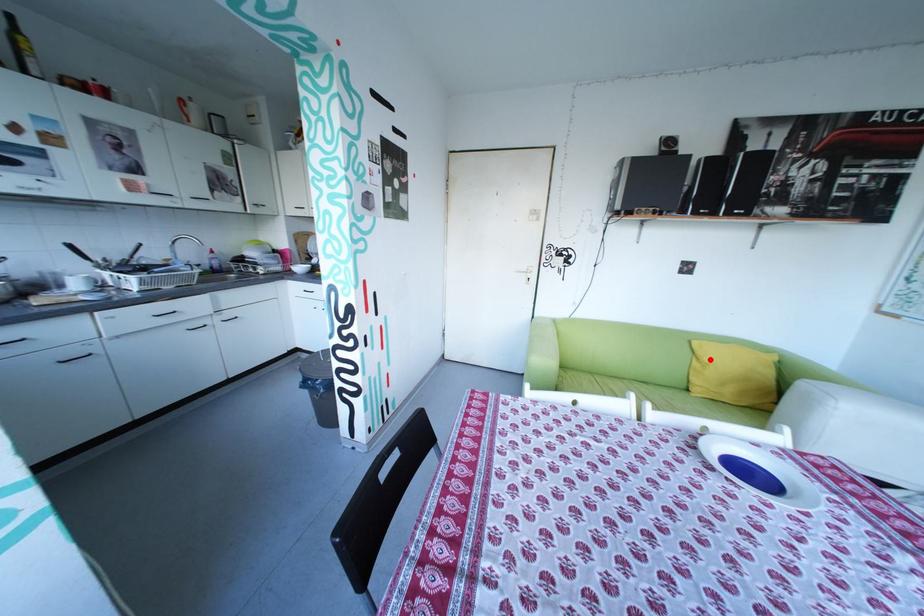
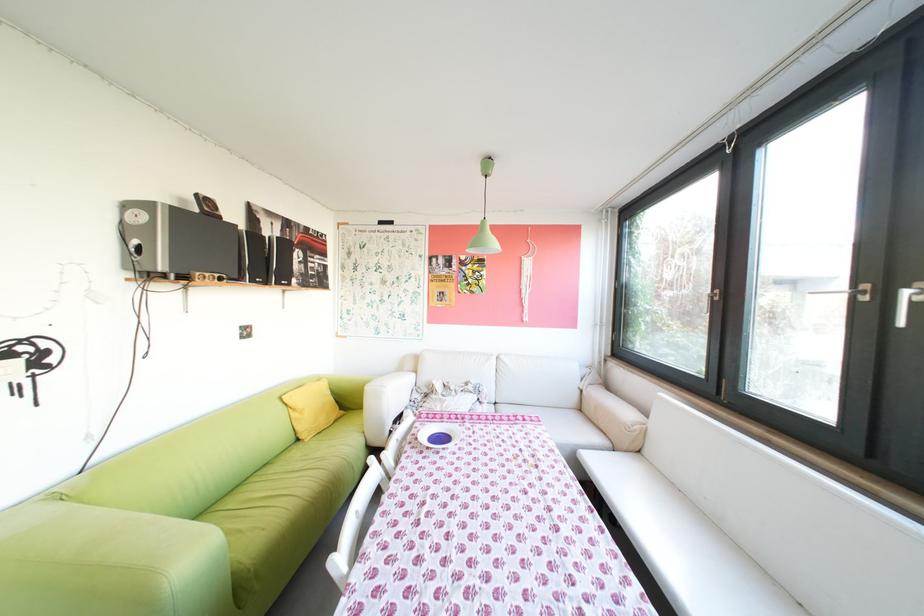
The point at the highlighted location is marked in the first image. Where is the corresponding point in the second image?

(307, 410)